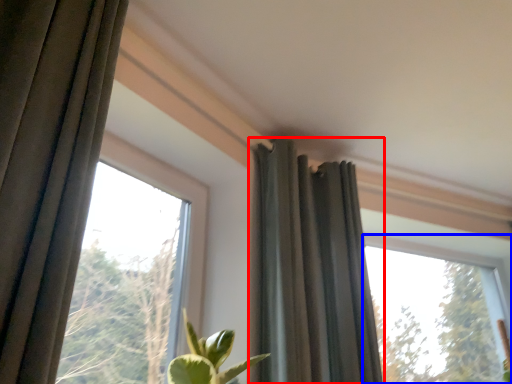
Question: Which of the following is the closest to the observer, curtain (highlighted by a red box) or window (highlighted by a blue box)?

Choices:
 (A) curtain
 (B) window

Answer: (A)